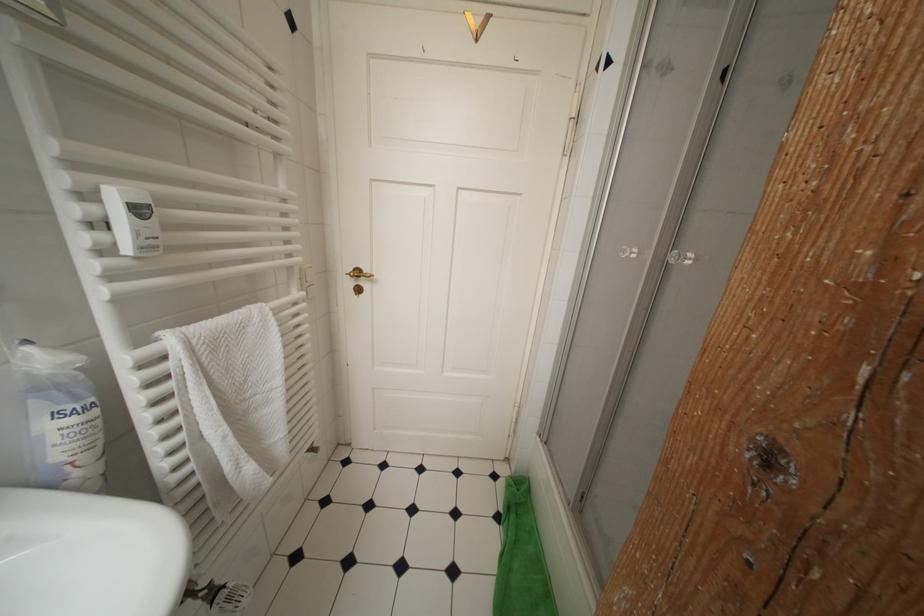
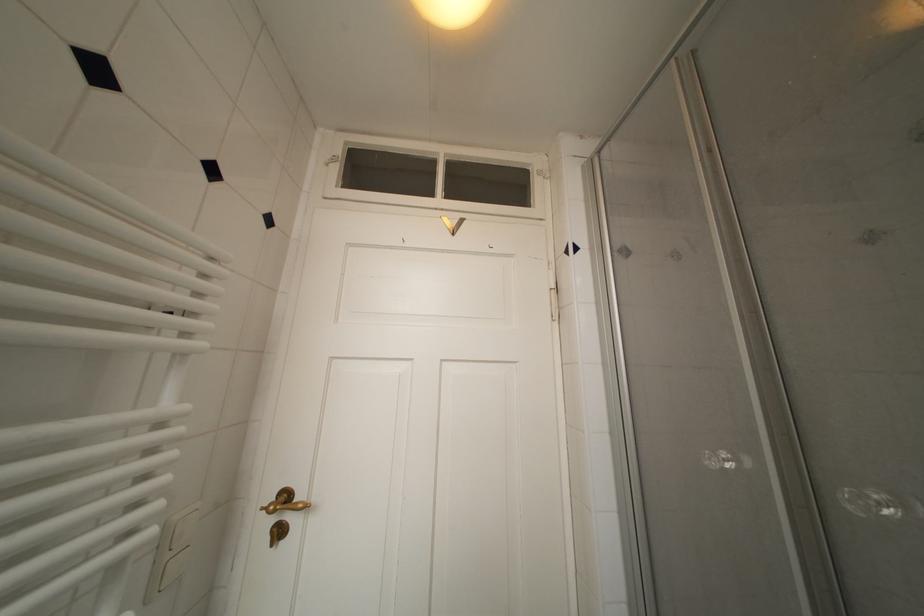
The point at (365, 276) is marked in the first image. Where is the corresponding point in the second image?

(293, 500)